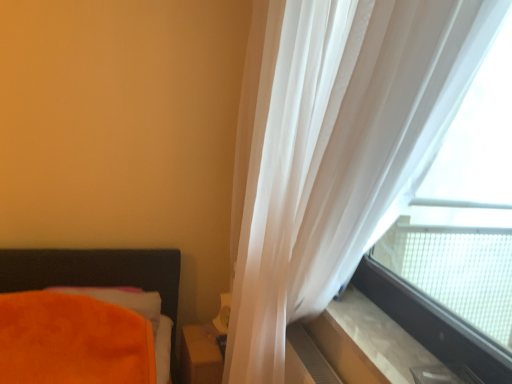
Where is `matte brown wooden table at lower center`? matte brown wooden table at lower center is located at coordinates (200, 355).

In order to click on orange plush pillow at lower left in this screenshot , I will do `click(122, 299)`.

What's the angular difference between orange plush pillow at lower left and translucent fabric at upper right's facing directions?

There is a 86.8-degree angle between the facing directions of orange plush pillow at lower left and translucent fabric at upper right.

From a real-world perspective, is orange plush pillow at lower left positioned under translucent fabric at upper right based on gravity?

Yes, from a real-world perspective, orange plush pillow at lower left is beneath translucent fabric at upper right.

Image resolution: width=512 pixels, height=384 pixels. In order to click on bay window on the right of orange plush pillow at lower left in this screenshot , I will do `click(466, 214)`.

Is point (154, 305) closer or farther from the camera than point (474, 178)?

Point (154, 305) is positioned farther from the camera compared to point (474, 178).

Is translucent fabric at upper right smaller than beige marble window sill at lower right?

No.

Can you confirm if translucent fabric at upper right is shorter than beige marble window sill at lower right?

No, translucent fabric at upper right is not shorter than beige marble window sill at lower right.

Does point (464, 202) come in front of point (375, 328)?

No, it is not.

Is translucent fabric at upper right wider or thinner than beige marble window sill at lower right?

In the image, translucent fabric at upper right appears to be more narrow than beige marble window sill at lower right.

Is translucent white curtain at right facing towards translucent fabric at upper right?

Yes, translucent white curtain at right faces towards translucent fabric at upper right.

From the image's perspective, would you say translucent white curtain at right is positioned over translucent fabric at upper right?

No, from the image's perspective, translucent white curtain at right is not on top of translucent fabric at upper right.

From the picture: Which is behind, translucent white curtain at right or translucent fabric at upper right?

translucent fabric at upper right is further from the camera.

From the image's perspective, between matte brown wooden table at lower center and beige marble window sill at lower right, which one is located above?

beige marble window sill at lower right appears higher in the image.

Between matte brown wooden table at lower center and beige marble window sill at lower right, which one has larger size?

With larger size is matte brown wooden table at lower center.

From a real-world perspective, is matte brown wooden table at lower center under beige marble window sill at lower right?

Yes.

Where is `table located underneath the beige marble window sill at lower right (from a real-world perspective)`? table located underneath the beige marble window sill at lower right (from a real-world perspective) is located at coordinates (200, 355).

Is orange plush pillow at lower left not inside beige marble window sill at lower right?

Yes, orange plush pillow at lower left is located beyond the bounds of beige marble window sill at lower right.

Is orange plush pillow at lower left oriented towards beige marble window sill at lower right?

No, orange plush pillow at lower left is not oriented towards beige marble window sill at lower right.

What's the angular difference between orange plush pillow at lower left and beige marble window sill at lower right's facing directions?

They differ by 88.1 degrees in their facing directions.

From the image's perspective, who appears lower, orange plush pillow at lower left or beige marble window sill at lower right?

From the image's view, orange plush pillow at lower left is below.

Measure the distance from translucent white curtain at right to orange plush pillow at lower left.

translucent white curtain at right is 95.75 centimeters from orange plush pillow at lower left.

Between translucent white curtain at right and orange plush pillow at lower left, which one has less height?

orange plush pillow at lower left is shorter.

Is orange plush pillow at lower left completely or partially inside translucent white curtain at right?

That's incorrect, orange plush pillow at lower left is not inside translucent white curtain at right.

Who is more distant, translucent white curtain at right or orange plush pillow at lower left?

Positioned behind is orange plush pillow at lower left.

Is point (194, 330) less distant than point (442, 229)?

No.

From the image's perspective, who appears lower, matte brown wooden table at lower center or translucent fabric at upper right?

From the image's view, matte brown wooden table at lower center is below.

Between matte brown wooden table at lower center and translucent fabric at upper right, which one has larger width?

Wider between the two is matte brown wooden table at lower center.

Where is `bay window in front of the orange plush pillow at lower left`? This screenshot has height=384, width=512. bay window in front of the orange plush pillow at lower left is located at coordinates (466, 214).

Find the location of `bay window that is above the beige marble window sill at lower right (from a real-world perspective)`. bay window that is above the beige marble window sill at lower right (from a real-world perspective) is located at coordinates (466, 214).

Estimate the real-world distances between objects in this image. Which object is further from matte brown wooden table at lower center, beige marble window sill at lower right or orange plush pillow at lower left?

beige marble window sill at lower right is further to matte brown wooden table at lower center.

Which object lies nearer to the anchor point translucent white curtain at right, matte brown wooden table at lower center or orange plush pillow at lower left?

The object closer to translucent white curtain at right is matte brown wooden table at lower center.

Which object lies further to the anchor point matte brown wooden table at lower center, orange plush pillow at lower left or translucent white curtain at right?

translucent white curtain at right is positioned further to the anchor matte brown wooden table at lower center.

From the image, which object appears to be farther from translucent white curtain at right, translucent fabric at upper right or matte brown wooden table at lower center?

matte brown wooden table at lower center lies further to translucent white curtain at right than the other object.

Considering their positions, is translucent fabric at upper right positioned further to orange plush pillow at lower left than beige marble window sill at lower right?

translucent fabric at upper right.

Estimate the real-world distances between objects in this image. Which object is closer to translucent fabric at upper right, orange plush pillow at lower left or beige marble window sill at lower right?

beige marble window sill at lower right is positioned closer to the anchor translucent fabric at upper right.

Considering their positions, is translucent white curtain at right positioned further to translucent fabric at upper right than orange plush pillow at lower left?

orange plush pillow at lower left is positioned further to the anchor translucent fabric at upper right.

When comparing their distances from beige marble window sill at lower right, does translucent white curtain at right or translucent fabric at upper right seem further?

Based on the image, translucent fabric at upper right appears to be further to beige marble window sill at lower right.

Identify the location of table between orange plush pillow at lower left and beige marble window sill at lower right. (200, 355).

This screenshot has width=512, height=384. Identify the location of window sill situated between orange plush pillow at lower left and translucent fabric at upper right from left to right. (380, 337).

You are a GUI agent. You are given a task and a screenshot of the screen. Output one action in this format:
    pyautogui.click(x=<x>, y=<y>)
    Task: Click on the pillow between translucent white curtain at right and matte brown wooden table at lower center in the front-back direction
    The width and height of the screenshot is (512, 384).
    Given the screenshot: What is the action you would take?
    pyautogui.click(x=122, y=299)

Identify the location of bay window between translucent white curtain at right and orange plush pillow at lower left from front to back. (466, 214).